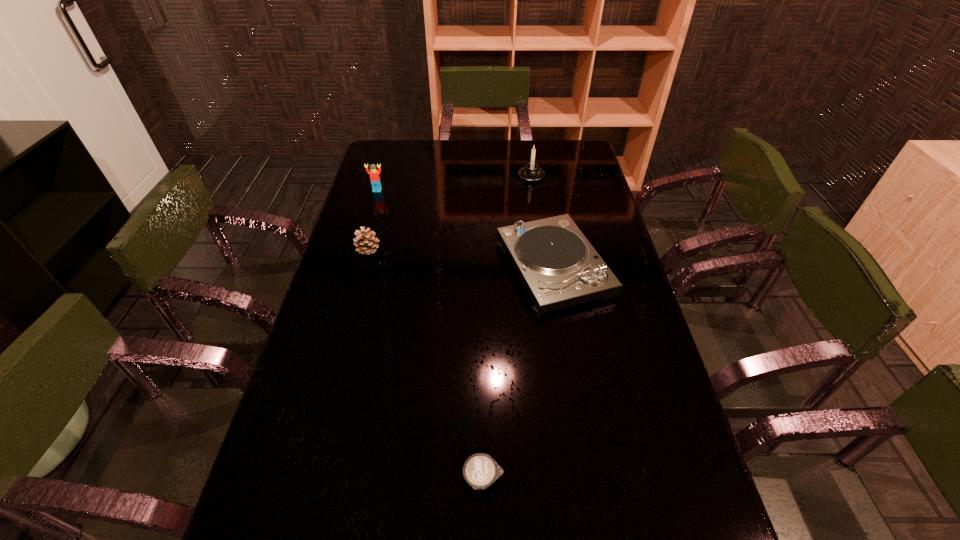
You are a GUI agent. You are given a task and a screenshot of the screen. Output one action in this format:
    pyautogui.click(x=<x>, y=<y>)
    Task: Click on the candle holder
    The height and width of the screenshot is (540, 960).
    Given the screenshot: What is the action you would take?
    pyautogui.click(x=531, y=172)

The width and height of the screenshot is (960, 540). What are the coordinates of `the farthest object` in the screenshot? It's located at 531,172.

Find the location of a particular element. Image resolution: width=960 pixels, height=540 pixels. the second tallest object is located at coordinates (374, 174).

I want to click on Lego, so click(x=374, y=174).

Locate an element on the screen. pinecone is located at coordinates (365, 241).

Locate an element on the screen. record player is located at coordinates (557, 265).

This screenshot has height=540, width=960. Find the location of `the shortest object`. the shortest object is located at coordinates (480, 470).

Find the location of a particular element. the nearest object is located at coordinates (480, 470).

In order to click on blank area located 0.250m with a handle on the side of the farthest object in this screenshot , I will do `click(539, 223)`.

Where is `vacant region located 0.300m on the face of the second tallest object`? vacant region located 0.300m on the face of the second tallest object is located at coordinates (362, 244).